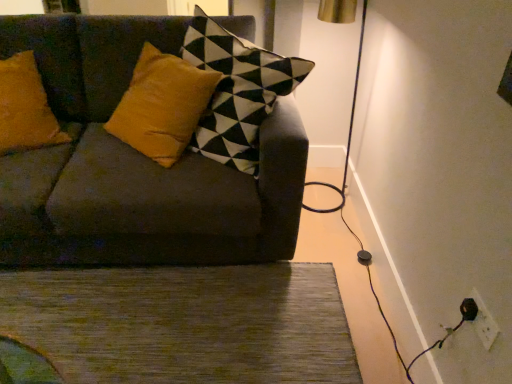
Question: Considering their positions, is green textured rug at lower center located in front of or behind velvet dark gray couch at center?

Choices:
 (A) front
 (B) behind

Answer: (B)

Question: Is point (29, 301) closer or farther from the camera than point (130, 64)?

Choices:
 (A) closer
 (B) farther

Answer: (A)

Question: Which is nearer to the white plastic electric outlet at lower right?

Choices:
 (A) velvet dark gray couch at center
 (B) green textured rug at lower center

Answer: (B)

Question: Based on their relative distances, which object is farther from the green textured rug at lower center?

Choices:
 (A) velvet dark gray couch at center
 (B) white plastic electric outlet at lower right

Answer: (B)